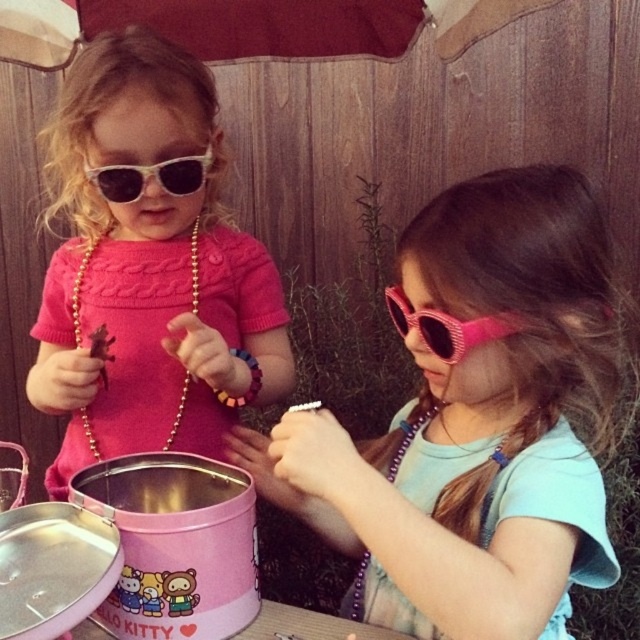
You are a delivery robot in the scene. You need to pick up the pink matte sunglasses at center and the white plastic sunglasses at upper left. What is the minimum distance you must travel to collect both items?

The minimum distance you must travel to collect both items is 18.54 inches, which is the distance between the pink matte sunglasses at center and the white plastic sunglasses at upper left.

You are a child who wants to try on the sunglasses in the image. Which pair, the pink glittery sunglasses at right or the white plastic sunglasses at upper left, would be more suitable if you prefer a larger size?

The pink glittery sunglasses at right has a larger size compared to the white plastic sunglasses at upper left, so it would be more suitable if you prefer a larger size.